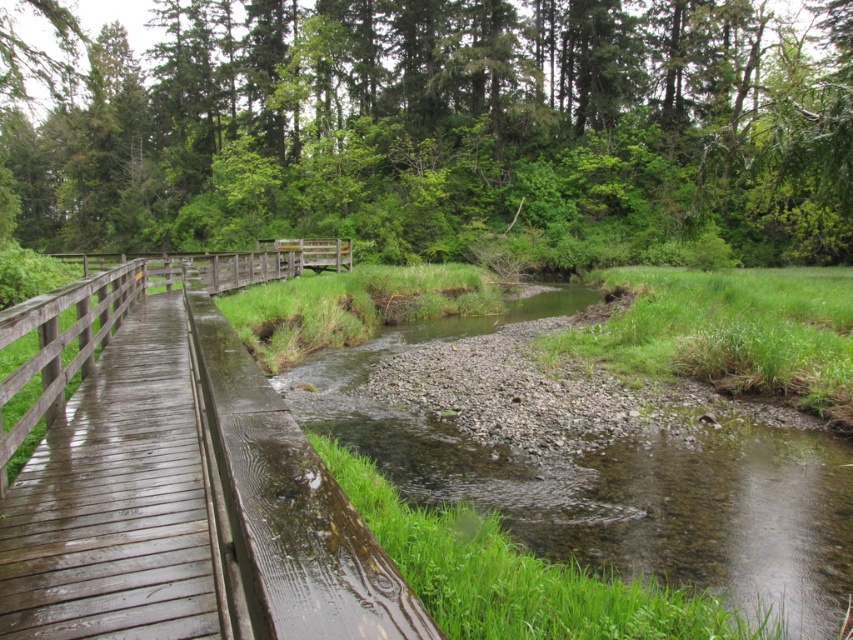
You are standing on the wooden boardwalk and want to cross to the green leafy forest at upper center. Which direction should you walk relative to the wooden bridge at center?

The green leafy forest at upper center is positioned on the right side of the wooden bridge at center, so you should walk towards the right side of the wooden bridge at center to reach it.